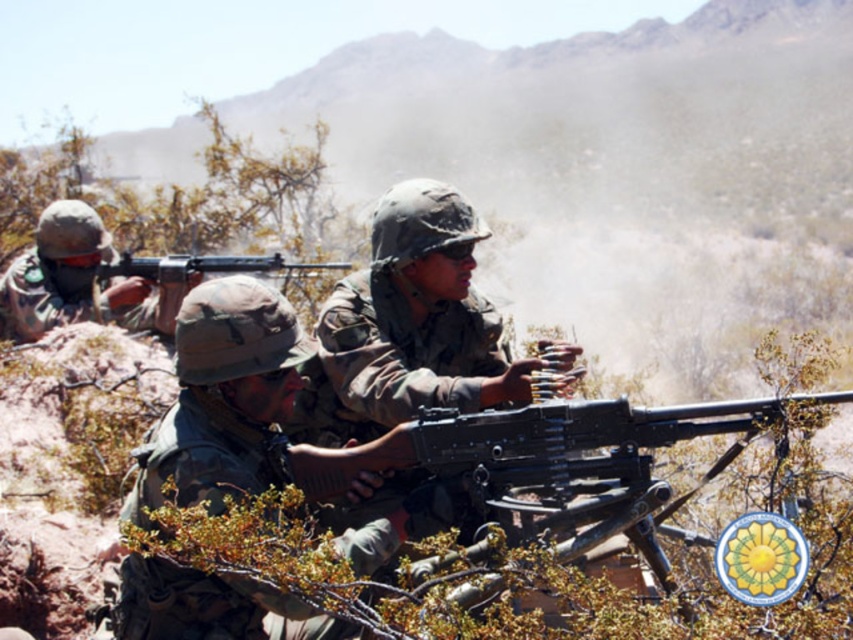
Does point (97, 298) come behind point (103, 275)?

That is False.

Can you confirm if matte green helmet at left is bigger than matte black machine gun at center?

Correct, matte green helmet at left is larger in size than matte black machine gun at center.

Is point (3, 330) less distant than point (112, 268)?

Yes.

You are a GUI agent. You are given a task and a screenshot of the screen. Output one action in this format:
    pyautogui.click(x=<x>, y=<y>)
    Task: Click on the matte green helmet at left
    The height and width of the screenshot is (640, 853).
    Given the screenshot: What is the action you would take?
    pyautogui.click(x=78, y=280)

Which is in front, point (546, 408) or point (120, 253)?

Point (546, 408) is in front.

Which is in front, point (616, 465) or point (274, 257)?

Point (616, 465) is in front.

The width and height of the screenshot is (853, 640). What are the coordinates of `metallic black machine gun at center` in the screenshot? It's located at (532, 445).

Does camouflage fabric uniform at center have a greater height compared to matte black machine gun at center?

Indeed, camouflage fabric uniform at center has a greater height compared to matte black machine gun at center.

Does camouflage fabric uniform at center have a larger size compared to matte black machine gun at center?

No.

What do you see at coordinates (224, 397) in the screenshot?
I see `camouflage fabric uniform at center` at bounding box center [224, 397].

This screenshot has height=640, width=853. I want to click on camouflage fabric uniform at center, so click(x=224, y=397).